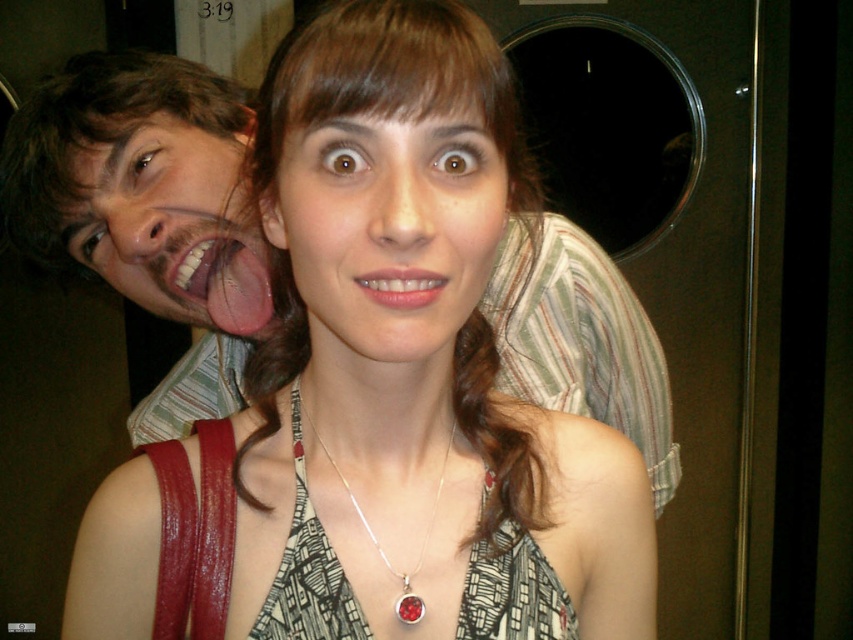
From the picture: Between matte fabric dress at center and matte skin face at upper left, which one has more height?

matte fabric dress at center is taller.

Which is in front, point (97, 490) or point (131, 200)?

Point (97, 490)

Locate an element on the screen. The width and height of the screenshot is (853, 640). matte fabric dress at center is located at coordinates (410, 369).

Is silver/red gemstone pendant at center bigger than pink matte lips at center?

Yes.

Who is positioned more to the right, silver/red gemstone pendant at center or pink matte lips at center?

From the viewer's perspective, pink matte lips at center appears more on the right side.

Which is behind, point (396, 572) or point (368, 294)?

Point (396, 572)

What are the coordinates of `silver/red gemstone pendant at center` in the screenshot? It's located at pyautogui.click(x=375, y=536).

Is matte fabric dress at center taller than silver/red gemstone pendant at center?

Indeed, matte fabric dress at center has a greater height compared to silver/red gemstone pendant at center.

Find the location of a particular element. This screenshot has width=853, height=640. matte fabric dress at center is located at coordinates [x=410, y=369].